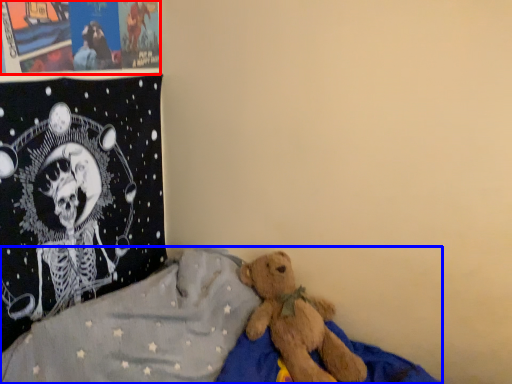
Question: Which point is closer to the camera, poster page (highlighted by a red box) or bed (highlighted by a blue box)?

Choices:
 (A) poster page
 (B) bed

Answer: (B)